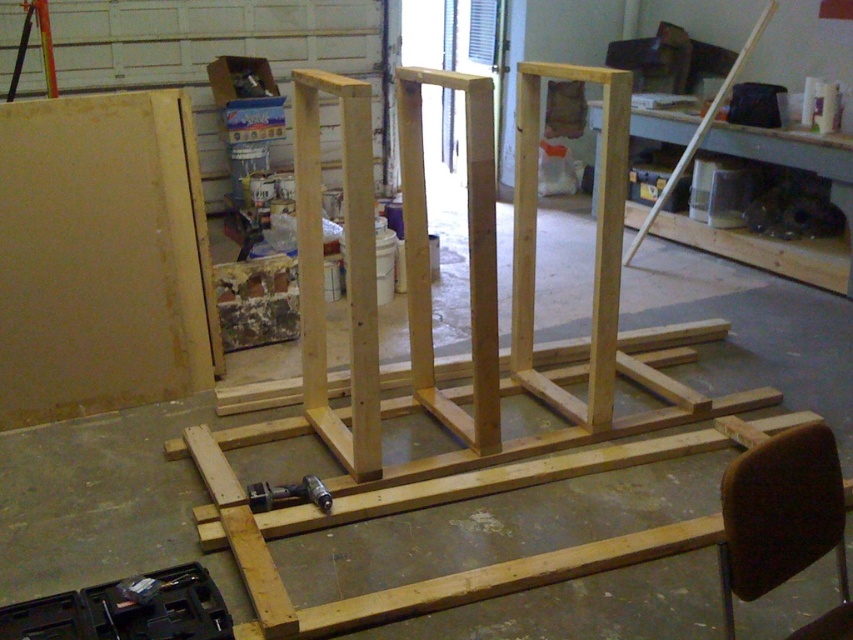
You are standing in the workshop and see the wooden frame structure. There is a point marked at coordinates (102, 257). What color is the material located at that point?

The point at coordinates (102, 257) marks matte yellow wood at left.

You are a construction worker who needs to move a heavy beam from the point at coordinates point (47, 241) to the frame structure. The beam is 3 meters long. Can you safely move it without bending or breaking the beam?

The distance between point (47, 241) and the frame structure is 3.08 meters. Since the beam is 3 meters long, it is slightly shorter than the required distance. Moving it might risk bending or breaking the beam if not handled carefully. Ensure proper support during transportation.

You are a contractor standing in front of the wooden frame structure in the workshop. You notice two points marked as point 1 and point 2. Point 1 is at coordinate (206, 257) and point 2 is at (281, 496). Which point is closer to your current position?

Point 1 at coordinate (206, 257) is closer to your current position because it is further to the camera than point 2 at (281, 496).